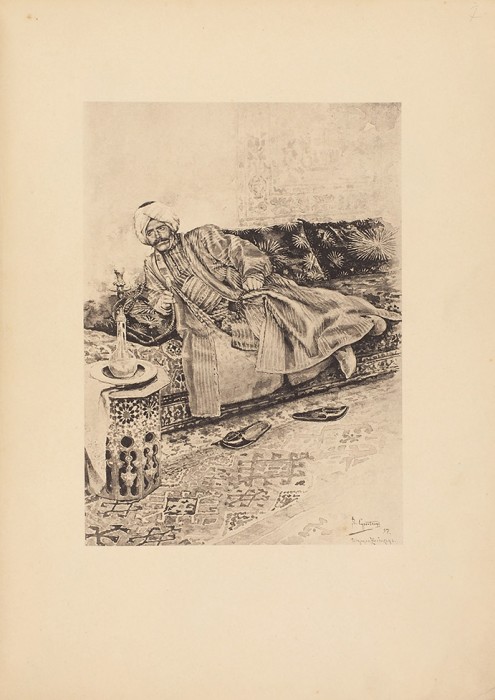
You are a GUI agent. You are given a task and a screenshot of the screen. Output one action in this format:
    pyautogui.click(x=<x>, y=<y>)
    Task: Click on the white cloth draped over top of end table, lower left
    The image size is (495, 700).
    Given the screenshot: What is the action you would take?
    pyautogui.click(x=115, y=411), pyautogui.click(x=100, y=456), pyautogui.click(x=97, y=407), pyautogui.click(x=95, y=440)